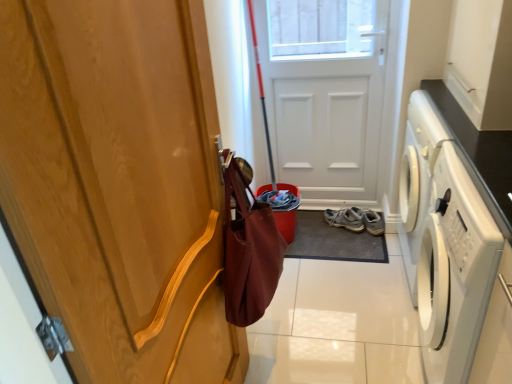
Question: Looking at the image, does wooden door handle at left, which is the 1th door in left-to-right order, seem bigger or smaller compared to white matte door at center, marked as the 1th door in a back-to-front arrangement?

Choices:
 (A) big
 (B) small

Answer: (B)

Question: Is wooden door handle at left, which is the 1th door in left-to-right order, spatially inside white matte door at center, marked as the 1th door in a back-to-front arrangement, or outside of it?

Choices:
 (A) outside
 (B) inside

Answer: (A)

Question: Based on their relative distances, which object is farther from the white glossy washing machine at right?

Choices:
 (A) white matte door at center, which ranks as the 1th door in right-to-left order
 (B) matte brown tote at center
 (C) white glossy tile at lower center
 (D) light brown suede sneakers at lower center
 (E) wooden door handle at left, which is the 1th door in left-to-right order

Answer: (D)

Question: Which of these objects is positioned closest to the light brown suede sneakers at lower center?

Choices:
 (A) white glossy washing machine at right
 (B) matte brown tote at center
 (C) white matte door at center, which ranks as the 1th door in right-to-left order
 (D) dark gray rubber doormat at center
 (E) white glossy tile at lower center

Answer: (D)